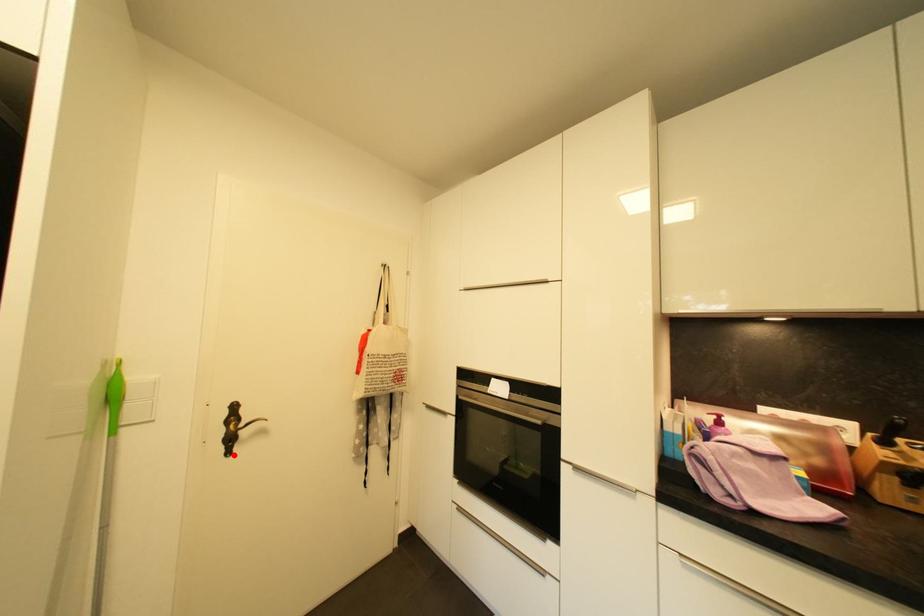
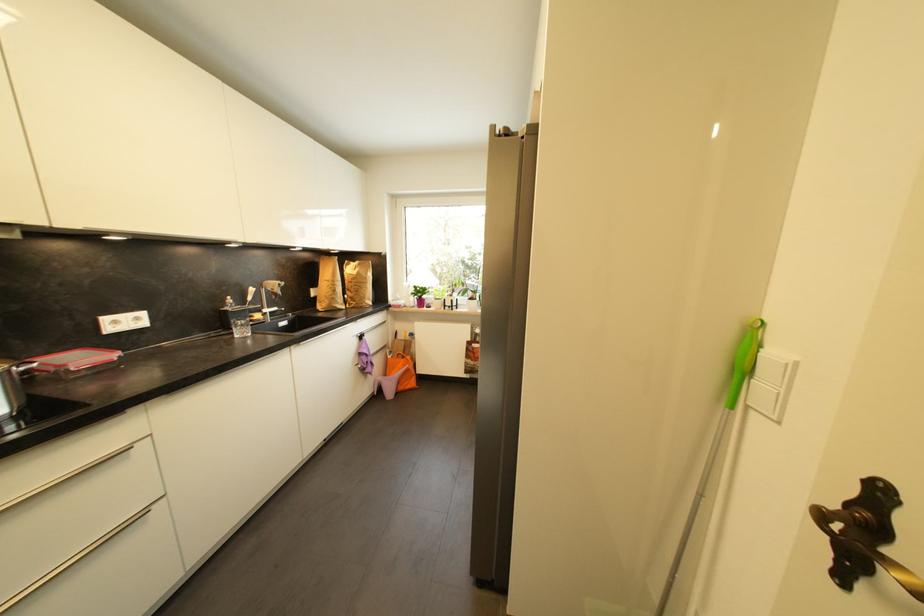
Locate, in the second image, the point that corresponds to the highlighted location in the first image.

(846, 581)